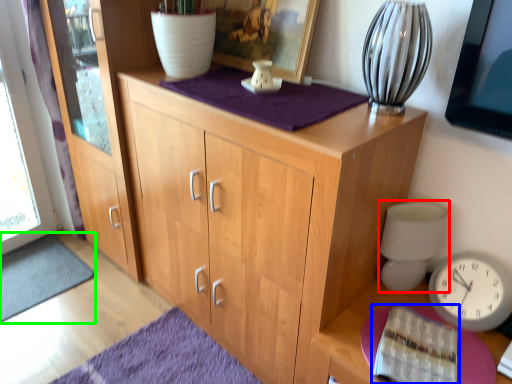
Question: Which is nearer to the table lamp (highlighted by a red box)? book (highlighted by a blue box) or doormat (highlighted by a green box).

Choices:
 (A) book
 (B) doormat

Answer: (A)